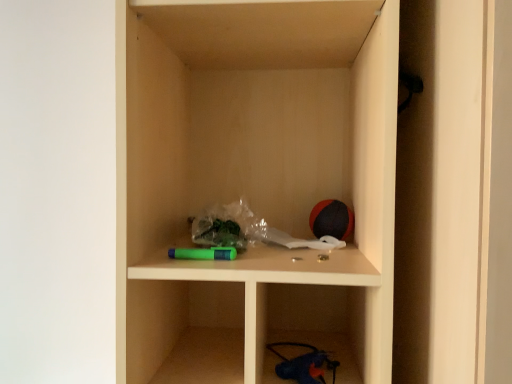
Question: Is matte plastic cabinet at center at the right side of rubberized red and black ball at upper right?

Choices:
 (A) yes
 (B) no

Answer: (B)

Question: Is matte plastic cabinet at center positioned in front of rubberized red and black ball at upper right?

Choices:
 (A) yes
 (B) no

Answer: (A)

Question: Is matte plastic cabinet at center not close to rubberized red and black ball at upper right?

Choices:
 (A) no
 (B) yes

Answer: (A)

Question: From the image's perspective, does matte plastic cabinet at center appear lower than rubberized red and black ball at upper right?

Choices:
 (A) no
 (B) yes

Answer: (A)

Question: Considering the relative sizes of matte plastic cabinet at center and rubberized red and black ball at upper right in the image provided, is matte plastic cabinet at center taller than rubberized red and black ball at upper right?

Choices:
 (A) no
 (B) yes

Answer: (B)

Question: Is matte plastic cabinet at center with rubberized red and black ball at upper right?

Choices:
 (A) no
 (B) yes

Answer: (A)

Question: Can you confirm if rubberized red and black ball at upper right is smaller than matte plastic cabinet at center?

Choices:
 (A) yes
 (B) no

Answer: (A)

Question: Can we say rubberized red and black ball at upper right lies outside matte plastic cabinet at center?

Choices:
 (A) yes
 (B) no

Answer: (B)

Question: Is rubberized red and black ball at upper right bigger than matte plastic cabinet at center?

Choices:
 (A) no
 (B) yes

Answer: (A)

Question: Is matte plastic cabinet at center at the back of rubberized red and black ball at upper right?

Choices:
 (A) yes
 (B) no

Answer: (A)

Question: Is rubberized red and black ball at upper right shorter than matte plastic cabinet at center?

Choices:
 (A) no
 (B) yes

Answer: (B)

Question: Can you confirm if rubberized red and black ball at upper right is wider than matte plastic cabinet at center?

Choices:
 (A) yes
 (B) no

Answer: (B)

Question: Based on their positions, is matte plastic cabinet at center located to the left or right of rubberized red and black ball at upper right?

Choices:
 (A) right
 (B) left

Answer: (B)